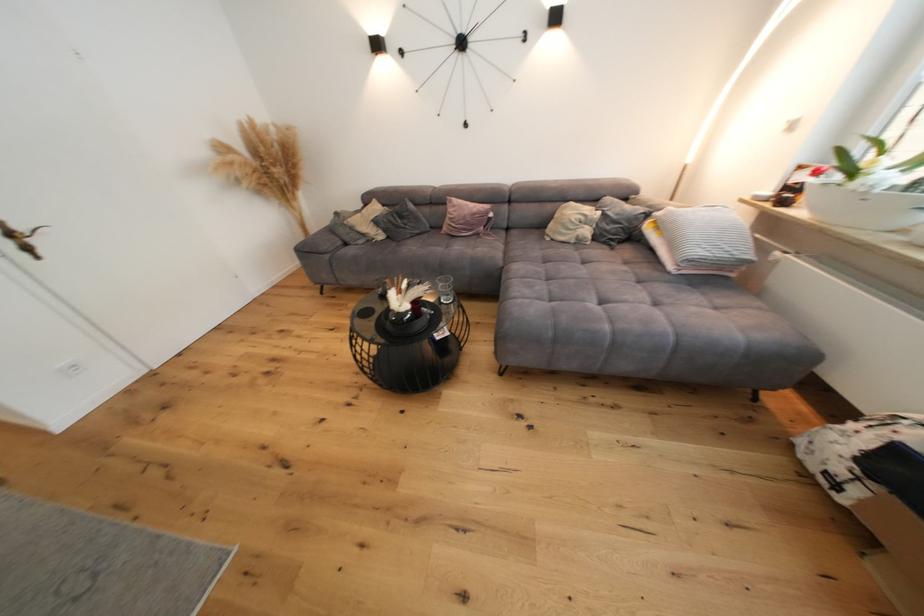
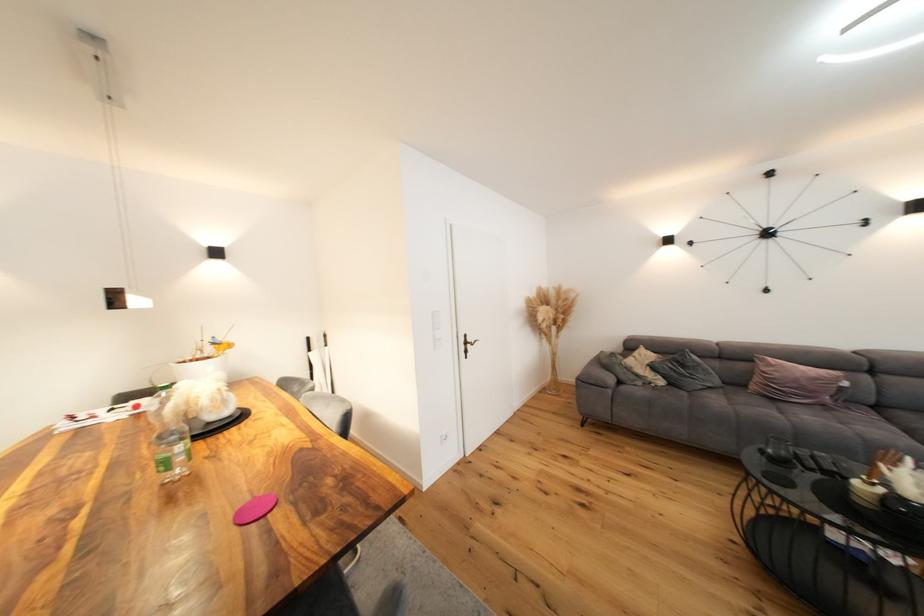
Where in the second image is the point corresponding to point 26,230 from the first image?

(476, 341)